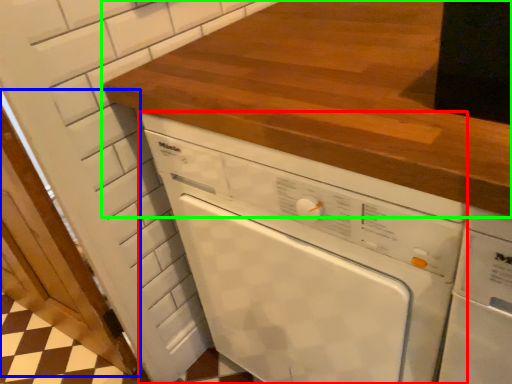
Question: Which object is positioned closest to home appliance (highlighted by a red box)? Select from door (highlighted by a blue box) and countertop (highlighted by a green box).

Choices:
 (A) door
 (B) countertop

Answer: (B)